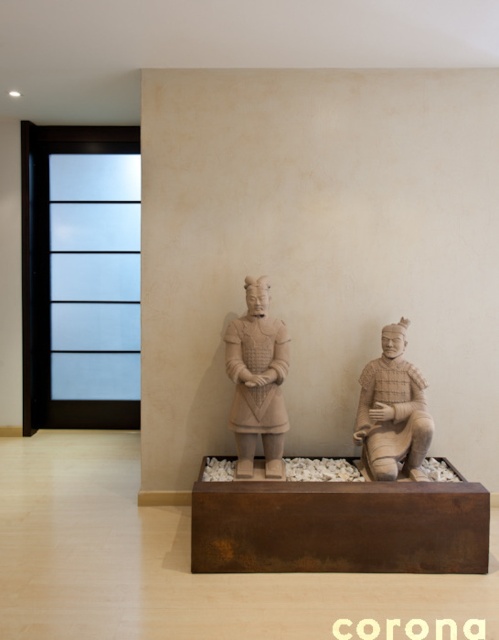
Locate an element on the screen. Image resolution: width=499 pixels, height=640 pixels. matte clay warrior at center is located at coordinates (257, 380).

Who is lower down, matte clay warrior at center or earthy clay warrior at center?

earthy clay warrior at center is below.

Is point (250, 424) positioned after point (408, 365)?

No, it is not.

You are a GUI agent. You are given a task and a screenshot of the screen. Output one action in this format:
    pyautogui.click(x=<x>, y=<y>)
    Task: Click on the matte clay warrior at center
    Image resolution: width=499 pixels, height=640 pixels.
    Given the screenshot: What is the action you would take?
    pyautogui.click(x=257, y=380)